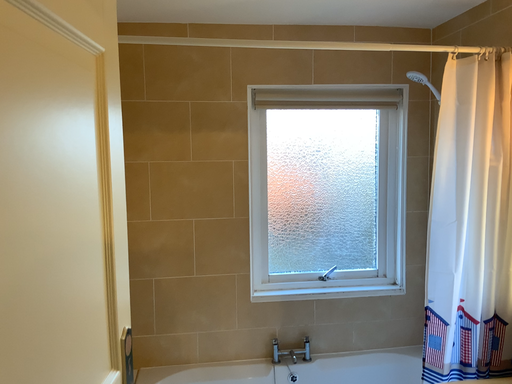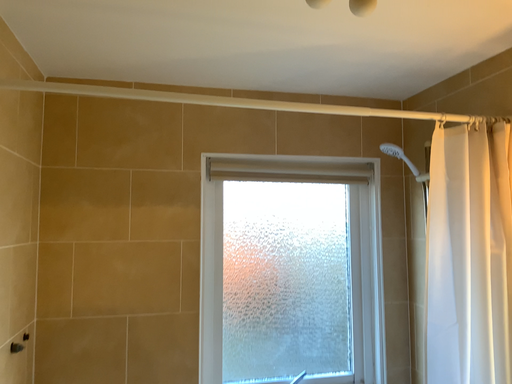
Question: How did the camera likely rotate when shooting the video?

Choices:
 (A) rotated upward
 (B) rotated downward

Answer: (A)